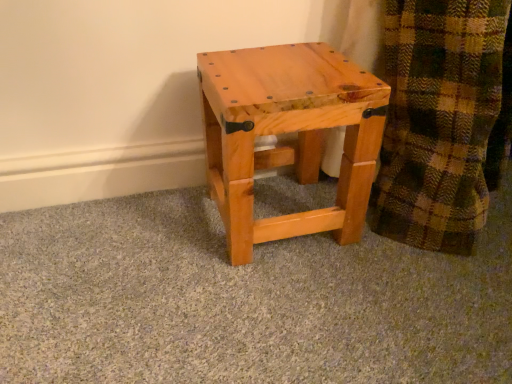
Identify the location of free spot to the left of natural wood stool at center. (153, 227).